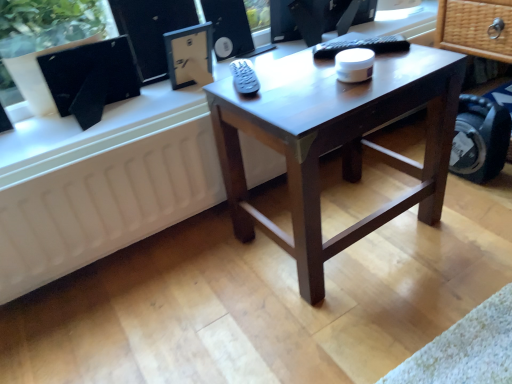
Find the location of a particular element. The image size is (512, 384). vacant area on top of black matte computer monitor at upper left (from a real-world perspective) is located at coordinates (73, 45).